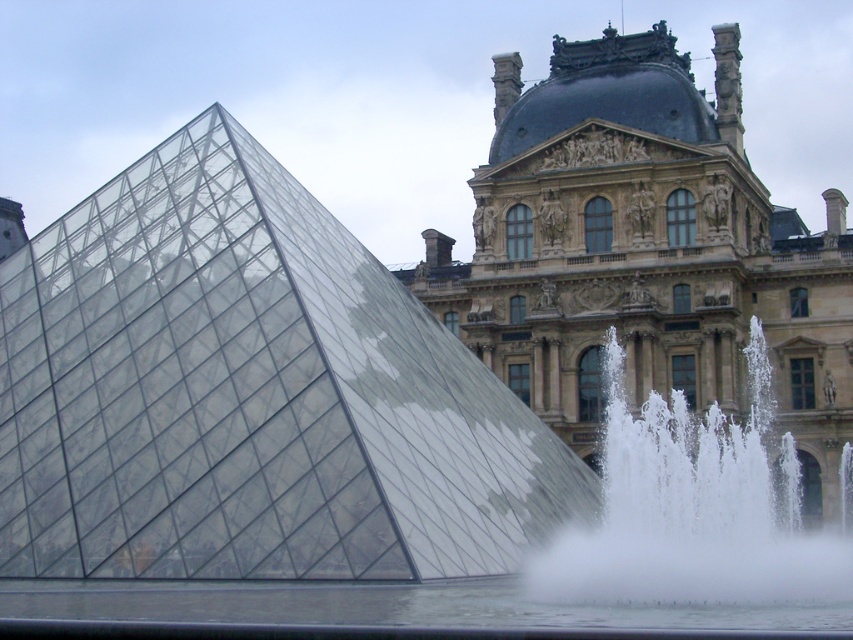
Question: Is golden stone palace at upper center to the left of white frothy water at lower right from the viewer's perspective?

Choices:
 (A) no
 (B) yes

Answer: (A)

Question: Which object is positioned closest to the golden stone palace at upper center?

Choices:
 (A) white frothy water at lower right
 (B) transparent glass pyramid at center

Answer: (A)

Question: Is transparent glass pyramid at center to the left of golden stone palace at upper center from the viewer's perspective?

Choices:
 (A) no
 (B) yes

Answer: (B)

Question: Which point is closer to the camera?

Choices:
 (A) tap(740, 125)
 (B) tap(97, 392)

Answer: (B)

Question: Is transparent glass pyramid at center below golden stone palace at upper center?

Choices:
 (A) yes
 (B) no

Answer: (A)

Question: Which object appears closest to the camera in this image?

Choices:
 (A) transparent glass pyramid at center
 (B) golden stone palace at upper center
 (C) white frothy water at lower right

Answer: (C)